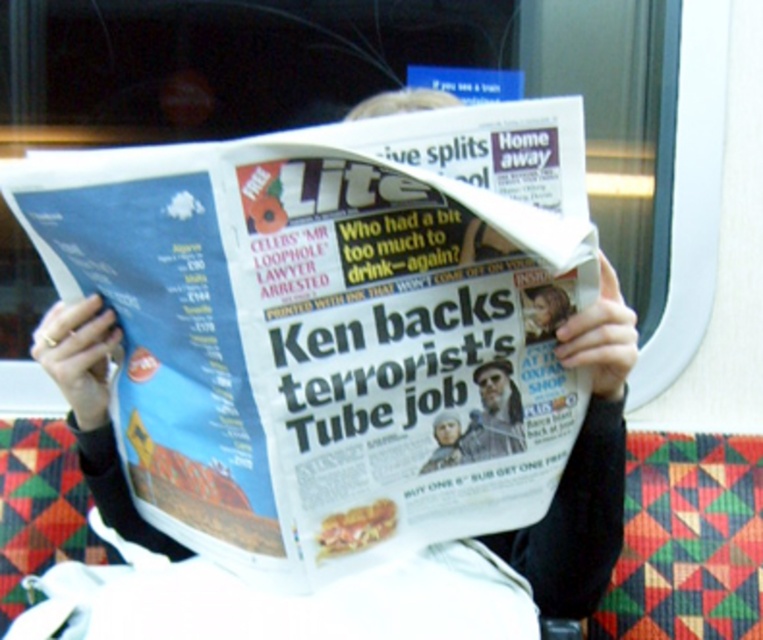
You are a photographer trying to capture a closeup of the gray beard at center without the white glossy newspaper at center blocking the view. Is the newspaper taller than the beard?

The white glossy newspaper at center is taller than gray beard at center, so it will block the view of the gray beard at center.

You are a passenger on a train and you want to read the newspaper. Where is the white glossy newspaper at center located?

The white glossy newspaper at center is located at point (330,323).

Looking at this image, you are a passenger sitting in the train and you have two points marked on the window. The first point is at coordinates point [555,429] and the second at point [504,444]. Which point is closer to you?

Point [555,429] is further to the viewer than point [504,444], so the second point is closer to you.